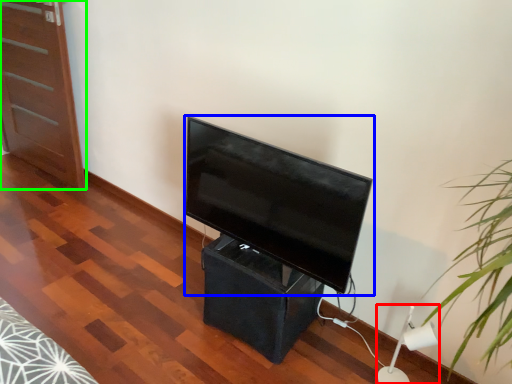
Question: Which is nearer to the lamp (highlighted by a red box)? television (highlighted by a blue box) or furniture (highlighted by a green box).

Choices:
 (A) television
 (B) furniture

Answer: (A)